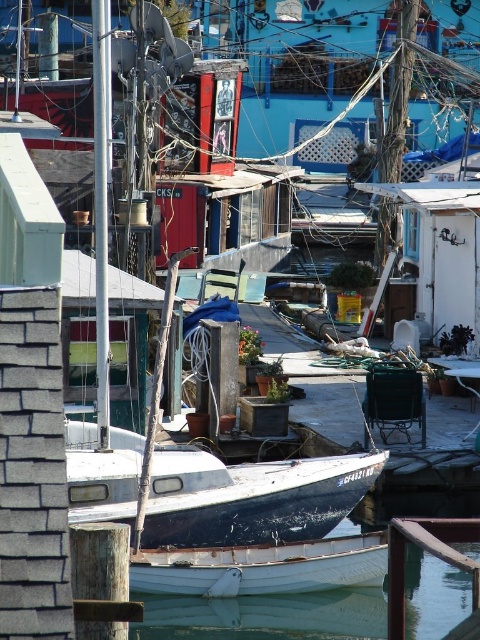
Question: Does white smooth water at lower center appear on the left side of white matte boat at lower center?

Choices:
 (A) yes
 (B) no

Answer: (B)

Question: Which point is farther to the camera?

Choices:
 (A) white smooth water at lower center
 (B) white matte boat at lower center

Answer: (A)

Question: Which of the following is the closest to the observer?

Choices:
 (A) (290, 554)
 (B) (280, 605)

Answer: (A)

Question: Can you confirm if white smooth water at lower center is bigger than white matte boat at lower center?

Choices:
 (A) no
 (B) yes

Answer: (B)

Question: Is white smooth water at lower center wider than white matte boat at lower center?

Choices:
 (A) yes
 (B) no

Answer: (A)

Question: Which of the following is the closest to the observer?

Choices:
 (A) (474, 557)
 (B) (190, 586)

Answer: (B)